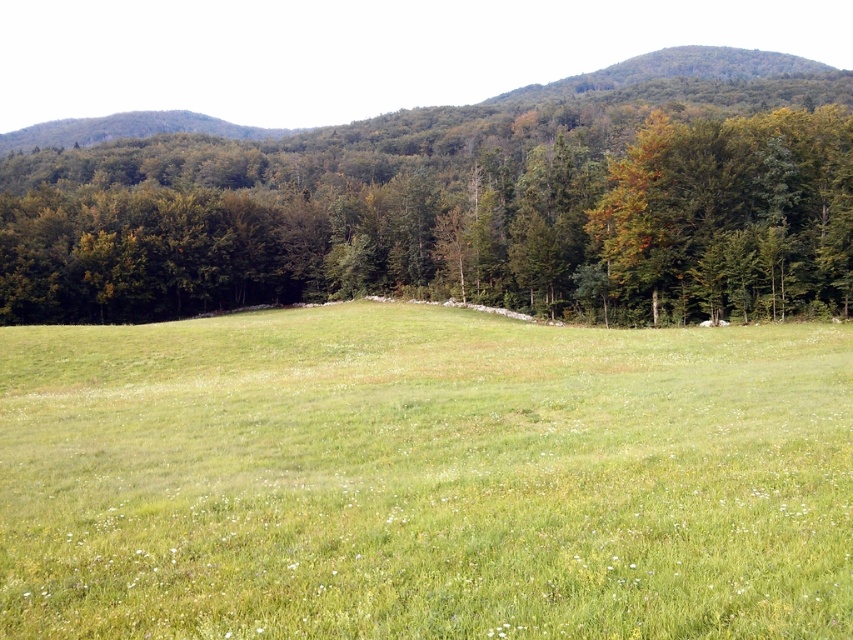
Question: Does green grassy field at center lie behind green leafy tree at center?

Choices:
 (A) yes
 (B) no

Answer: (B)

Question: Is green grassy field at center to the left of green leafy tree at center from the viewer's perspective?

Choices:
 (A) yes
 (B) no

Answer: (A)

Question: Can you confirm if green grassy field at center is positioned to the right of green leafy tree at center?

Choices:
 (A) yes
 (B) no

Answer: (B)

Question: Which point appears farthest from the camera in this image?

Choices:
 (A) (706, 433)
 (B) (399, 166)

Answer: (B)